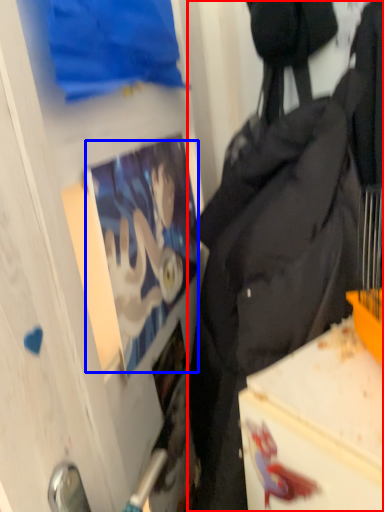
Question: Which object is closer to the camera taking this photo, backpack (highlighted by a red box) or person (highlighted by a blue box)?

Choices:
 (A) backpack
 (B) person

Answer: (A)